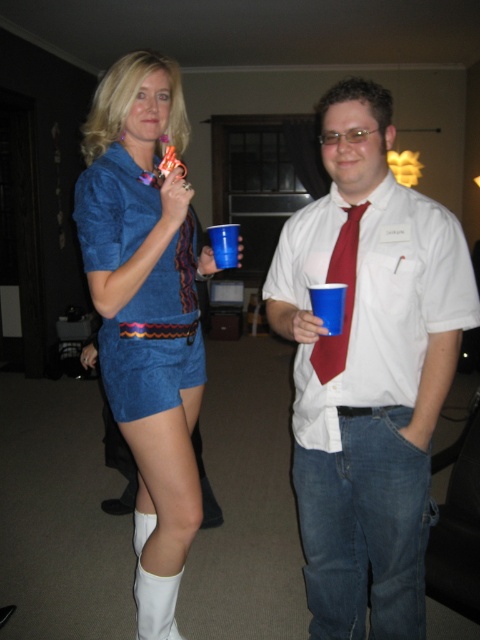
You are at a party and need to find the white cotton shirt at center. According to the spatial description, where exactly is it positioned in the image?

The white cotton shirt at center is located at point coordinates of 0.578 on the x axis and 0.767 on the y axis.

You are a photographer at this gathering and need to adjust the camera focus. Since the white cotton shirt at center and the matte red tie at center are both in the frame, which one should you focus on to ensure it appears larger in the photo?

The white cotton shirt at center is taller than the matte red tie at center, so focusing on the white cotton shirt at center will make it appear larger in the photo.

You are a photographer at a party and need to position a matte blue dress at center for a photo. According to the image, where exactly should you place it?

The matte blue dress at center should be placed at point coordinates of (146, 310).